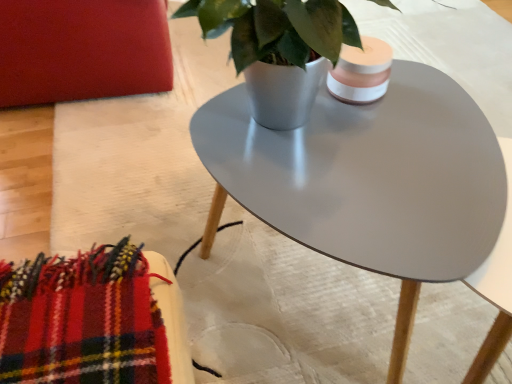
Image resolution: width=512 pixels, height=384 pixels. Find the location of `vacant space in matte gray pot at center (from a real-world perspective)`. vacant space in matte gray pot at center (from a real-world perspective) is located at coordinates (273, 128).